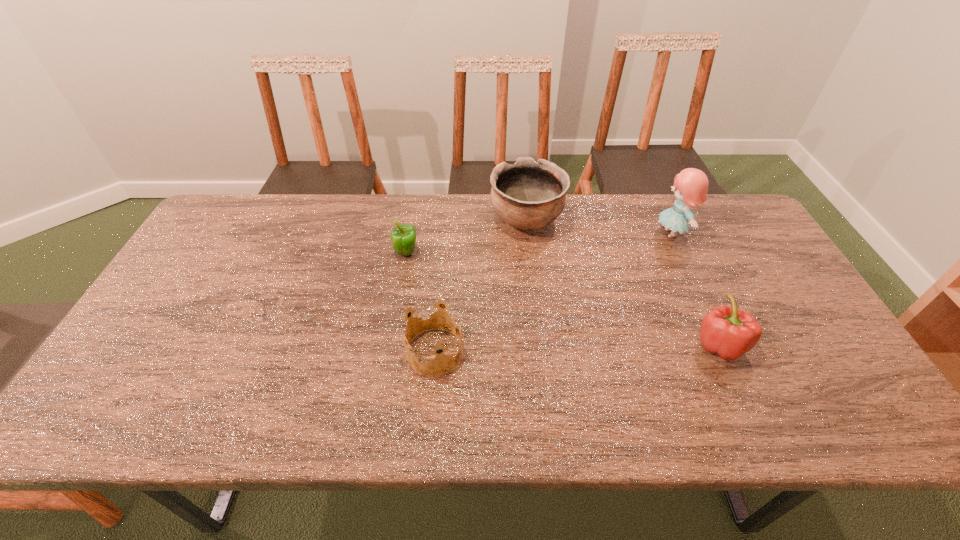
You are a GUI agent. You are given a task and a screenshot of the screen. Output one action in this format:
    pyautogui.click(x=<x>, y=<y>)
    Task: Click on the blank space located 0.250m on the front of the pottery
    
    Given the screenshot: What is the action you would take?
    pyautogui.click(x=536, y=306)

Locate an element on the screen. The width and height of the screenshot is (960, 540). vacant space located on the front of the leftmost object is located at coordinates (399, 294).

I want to click on vacant space located on the right of the right bell pepper, so click(x=833, y=345).

I want to click on vacant space situated 0.330m on the back of the second object from left to right, so click(x=444, y=244).

Where is `doll present at the far edge`? doll present at the far edge is located at coordinates (690, 188).

Identify the location of pottery at the far edge. (527, 195).

In the image, there is a desktop. Identify the location of blank space at the far edge. (598, 197).

In the image, there is a desktop. In order to click on blank space at the near edge in this screenshot , I will do `click(301, 426)`.

In the image, there is a desktop. Where is `free space at the left edge`? Image resolution: width=960 pixels, height=540 pixels. free space at the left edge is located at coordinates (168, 393).

The width and height of the screenshot is (960, 540). In the image, there is a desktop. Identify the location of vacant space at the right edge. (766, 264).